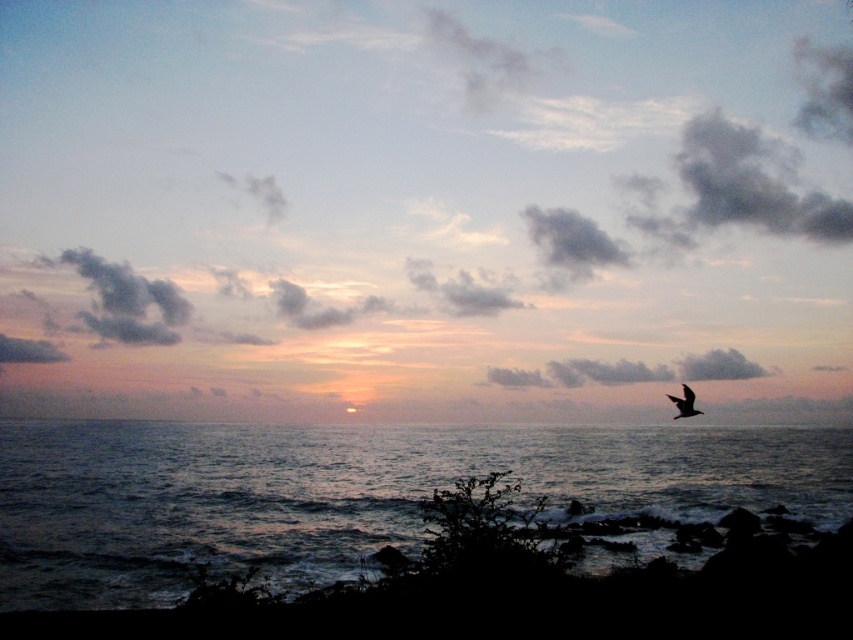
Is gray fluffy cloud at center wider than silvery metallic bird at right?

Correct, the width of gray fluffy cloud at center exceeds that of silvery metallic bird at right.

You are a GUI agent. You are given a task and a screenshot of the screen. Output one action in this format:
    pyautogui.click(x=<x>, y=<y>)
    Task: Click on the gray fluffy cloud at center
    This screenshot has height=640, width=853.
    Given the screenshot: What is the action you would take?
    pyautogui.click(x=631, y=371)

Between point (35, 328) and point (738, 371), which one is positioned behind?

Point (35, 328)

Does dark gray cloud at upper center have a greater height compared to gray fluffy cloud at center?

Correct, dark gray cloud at upper center is much taller as gray fluffy cloud at center.

Does point (718, 204) lie in front of point (727, 368)?

No.

This screenshot has width=853, height=640. What are the coordinates of `dark gray cloud at upper center` in the screenshot? It's located at (426, 186).

Between dark gray cloud at upper center and silvery metallic bird at right, which one is positioned higher?

dark gray cloud at upper center is higher up.

Consider the image. Does dark gray cloud at upper center have a larger size compared to silvery metallic bird at right?

Yes.

Is point (577, 100) more distant than point (683, 388)?

Yes, it is.

Where is `dark gray cloud at upper center`? The width and height of the screenshot is (853, 640). dark gray cloud at upper center is located at coordinates (426, 186).